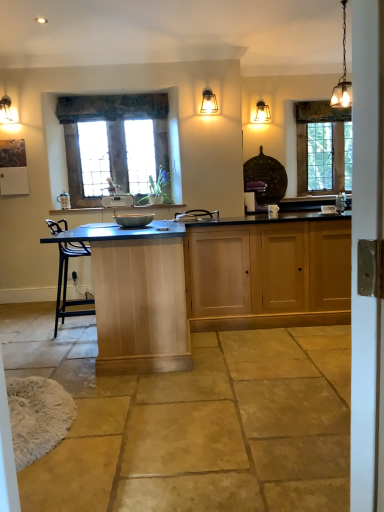
Locate an element on the screen. This screenshot has height=512, width=384. free space in front of light oak cabinet at center, the first cabinetry positioned from the right is located at coordinates (284, 348).